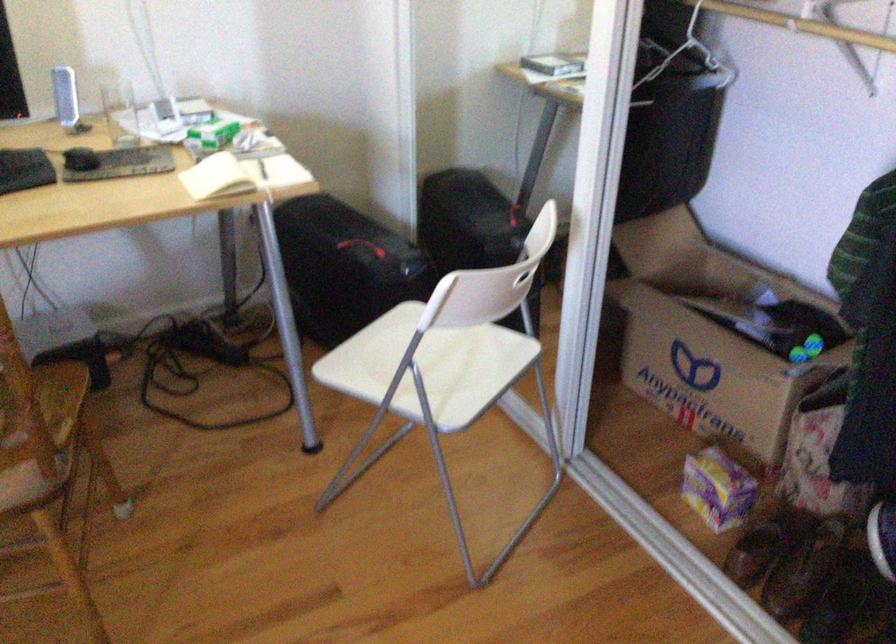
Where is `chair sitting surface`? The height and width of the screenshot is (644, 896). chair sitting surface is located at coordinates (39, 430).